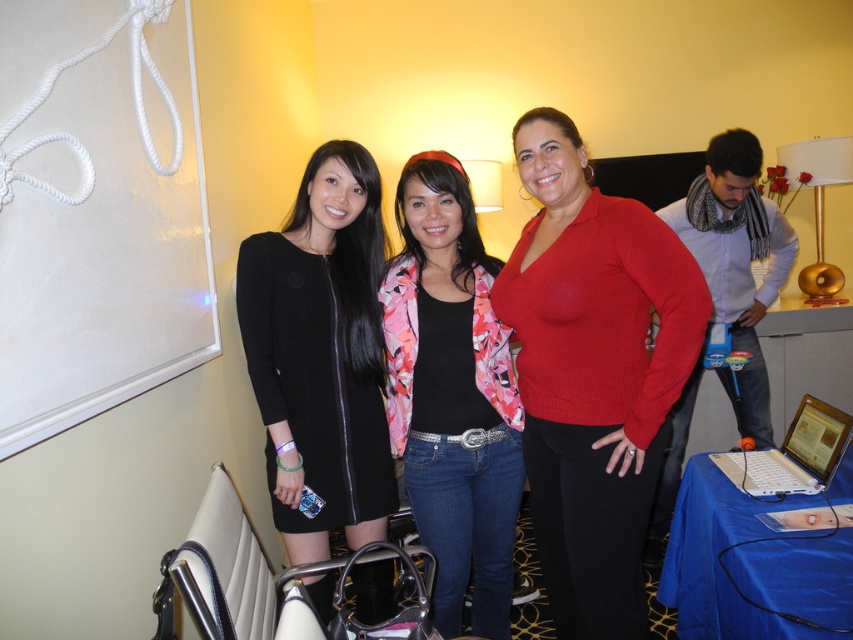
Question: Estimate the real-world distances between objects in this image. Which object is closer to the white glossy laptop at right?

Choices:
 (A) black matte dress at center
 (B) floral-patterned jacket at center
 (C) knit red sweater at center
 (D) white plastic laptop at lower right

Answer: (D)

Question: Is black matte dress at center above floral-patterned jacket at center?

Choices:
 (A) no
 (B) yes

Answer: (B)

Question: Which object is closer to the camera taking this photo?

Choices:
 (A) black matte dress at center
 (B) white glossy laptop at right
 (C) floral-patterned jacket at center
 (D) knit red sweater at center

Answer: (D)

Question: Is knit red sweater at center smaller than white plastic laptop at lower right?

Choices:
 (A) yes
 (B) no

Answer: (B)

Question: Which object appears closest to the camera in this image?

Choices:
 (A) black matte dress at center
 (B) knit red sweater at center
 (C) white plastic laptop at lower right

Answer: (B)

Question: Does black matte dress at center come behind floral-patterned jacket at center?

Choices:
 (A) yes
 (B) no

Answer: (B)